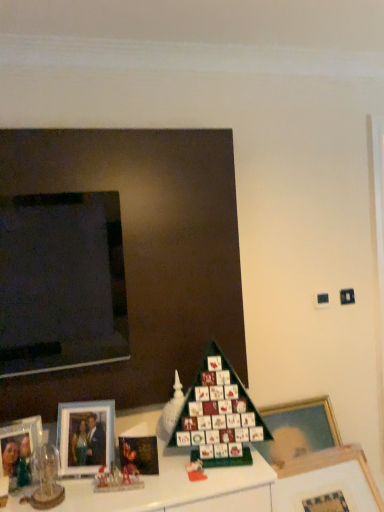
Locate an element on the screen. space that is in front of green cardboard christmas tree at center is located at coordinates (208, 480).